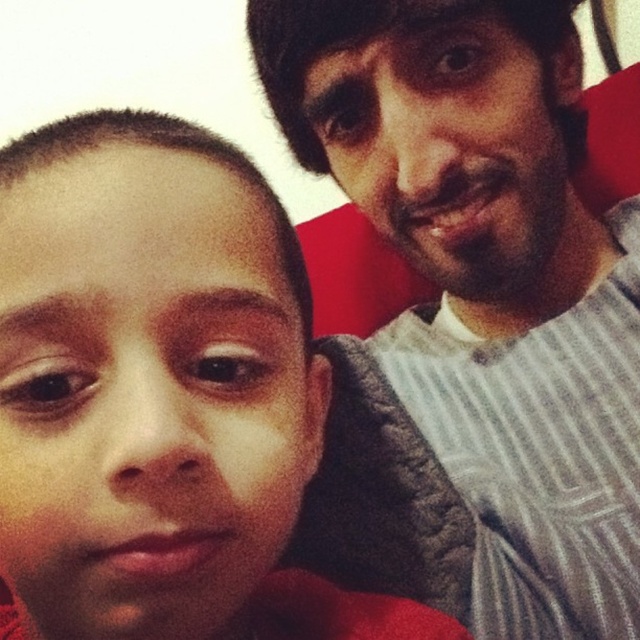
You are a photographer trying to capture a portrait of the child in the scene. You need to ensure that the subject is in focus while keeping the background slightly blurred. Given that the camera is positioned at a certain distance from the point labeled as point (440, 440), which is on the child, can you determine if the depth of field will be sufficient to achieve this effect?

The distance between the camera and point (440, 440) is 25.76 inches. To achieve a blurred background, the depth of field should be narrow. At this distance, if the camera uses a wide aperture, the depth of field will be shallow enough to keep the child in focus while blurring the background.

You are taking a photo of two points in the scene. The first point is at coordinate point (x=488, y=19) and the second is at point (x=211, y=426). Which point is closer to the camera?

Point (x=488, y=19) is further to the camera than point (x=211, y=426), so the second point is closer to the camera.

You are an observer standing in front of the image. You notice the matte skin child at center and the gray striped shirt at upper right. Which of these two is closer to you?

The matte skin child at center is closer to you because it is positioned in front of the gray striped shirt at upper right.